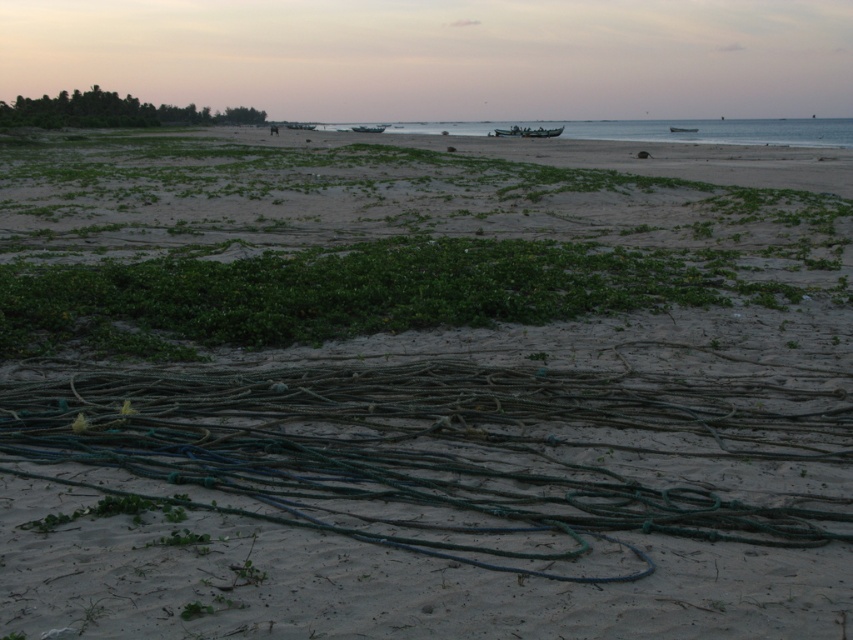
Looking at this image, which of these two, green leafy vegetation at center or green matte boat at center, stands taller?

Standing taller between the two is green matte boat at center.

Image resolution: width=853 pixels, height=640 pixels. What do you see at coordinates (344, 292) in the screenshot? I see `green leafy vegetation at center` at bounding box center [344, 292].

Is point (427, 241) more distant than point (364, 125)?

No, it is not.

You are a GUI agent. You are given a task and a screenshot of the screen. Output one action in this format:
    pyautogui.click(x=<x>, y=<y>)
    Task: Click on the green leafy vegetation at center
    
    Given the screenshot: What is the action you would take?
    [x=344, y=292]

Based on the photo, is clear blue water at center positioned at the back of green leafy vegetation at upper left?

No, clear blue water at center is closer to the viewer.

Can you confirm if clear blue water at center is positioned below green leafy vegetation at upper left?

Correct, clear blue water at center is located below green leafy vegetation at upper left.

Which is behind, point (793, 134) or point (198, 113)?

The point (198, 113) is behind.

Where is `clear blue water at center`? This screenshot has width=853, height=640. clear blue water at center is located at coordinates (712, 131).

Is point (759, 141) farther from camera compared to point (695, 131)?

No, it is in front of (695, 131).

Locate an element on the screen. The width and height of the screenshot is (853, 640). clear blue water at center is located at coordinates (712, 131).

Consider the image. Measure the distance between clear blue water at center and camera.

A distance of 67.83 meters exists between clear blue water at center and camera.

At what (x,y) coordinates should I click in order to perform the action: click on clear blue water at center. Please return your answer as a coordinate pair (x, y). The width and height of the screenshot is (853, 640). Looking at the image, I should click on (712, 131).